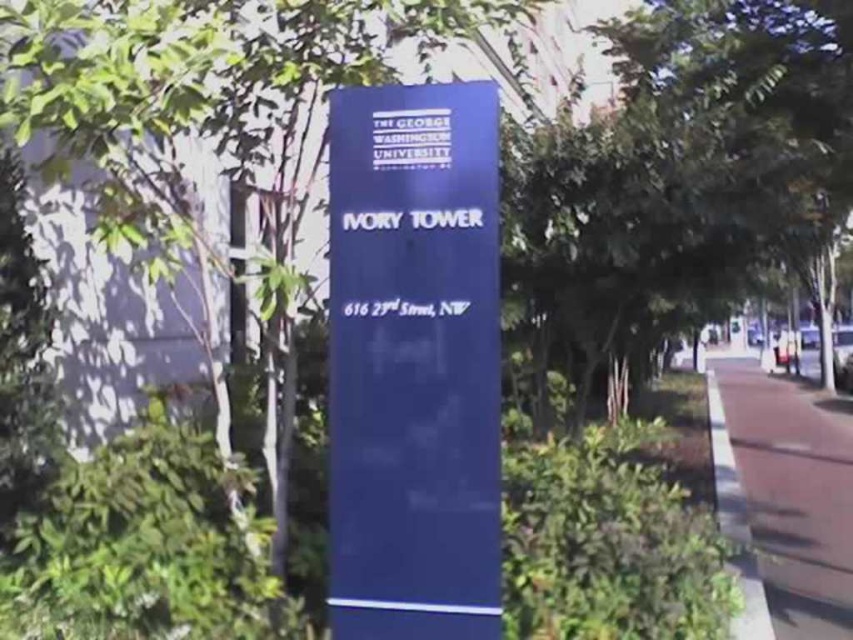
Question: Does blue glossy sign at center have a larger size compared to brown concrete pavement at lower right?

Choices:
 (A) yes
 (B) no

Answer: (B)

Question: Which object is closer to the camera taking this photo?

Choices:
 (A) white paper at upper center
 (B) white paper at center
 (C) white plastic sign at center
 (D) brown concrete pavement at lower right

Answer: (B)

Question: Does brown concrete pavement at lower right appear over white plastic sign at center?

Choices:
 (A) yes
 (B) no

Answer: (B)

Question: Which point is farther to the camera?

Choices:
 (A) brown concrete pavement at lower right
 (B) white paper at center

Answer: (A)

Question: Among these points, which one is farthest from the camera?

Choices:
 (A) (428, 308)
 (B) (393, 221)
 (C) (370, 637)

Answer: (C)

Question: Is white paper at upper center positioned behind white paper at center?

Choices:
 (A) no
 (B) yes

Answer: (B)